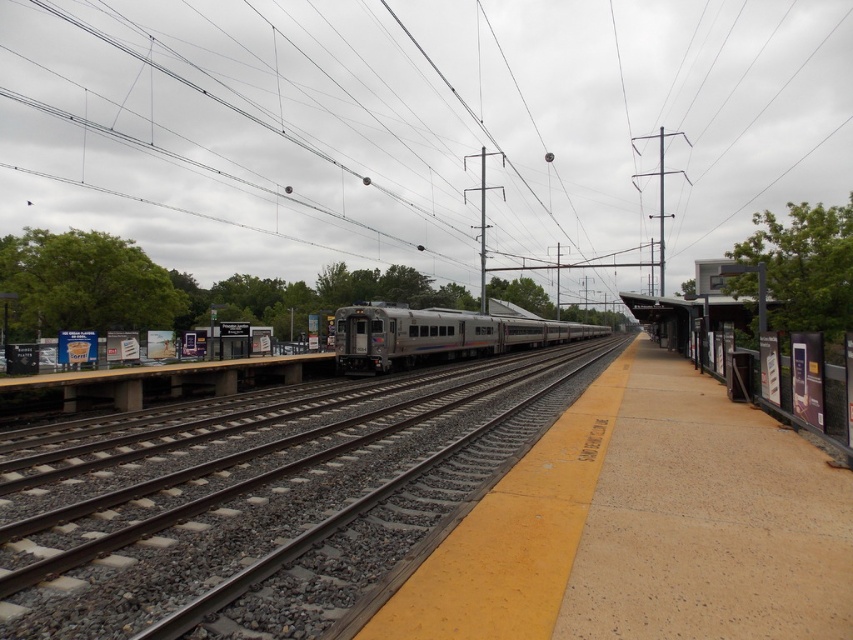
Consider the image. Is metallic wires at center below silver metallic train at center?

Incorrect, metallic wires at center is not positioned below silver metallic train at center.

Between point (22, 4) and point (384, 307), which one is positioned behind?

Point (22, 4)

Is point (241, 90) positioned after point (396, 342)?

Yes, point (241, 90) is behind point (396, 342).

This screenshot has width=853, height=640. In order to click on metallic wires at center in this screenshot , I will do `click(421, 124)`.

Between point (714, 529) and point (407, 364), which one is positioned behind?

The point (407, 364) is behind.

Can you confirm if concrete platform at center is positioned below silver metallic train at center?

Indeed, concrete platform at center is positioned under silver metallic train at center.

Between point (508, 580) and point (355, 348), which one is positioned behind?

The point (355, 348) is more distant.

The image size is (853, 640). What are the coordinates of `concrete platform at center` in the screenshot? It's located at (643, 525).

Between metallic wires at center and concrete platform at center, which one appears on the left side from the viewer's perspective?

From the viewer's perspective, metallic wires at center appears more on the left side.

Between metallic wires at center and concrete platform at center, which one appears on the right side from the viewer's perspective?

Positioned to the right is concrete platform at center.

Describe the element at coordinates (421, 124) in the screenshot. The width and height of the screenshot is (853, 640). I see `metallic wires at center` at that location.

The image size is (853, 640). What are the coordinates of `metallic wires at center` in the screenshot? It's located at (421, 124).